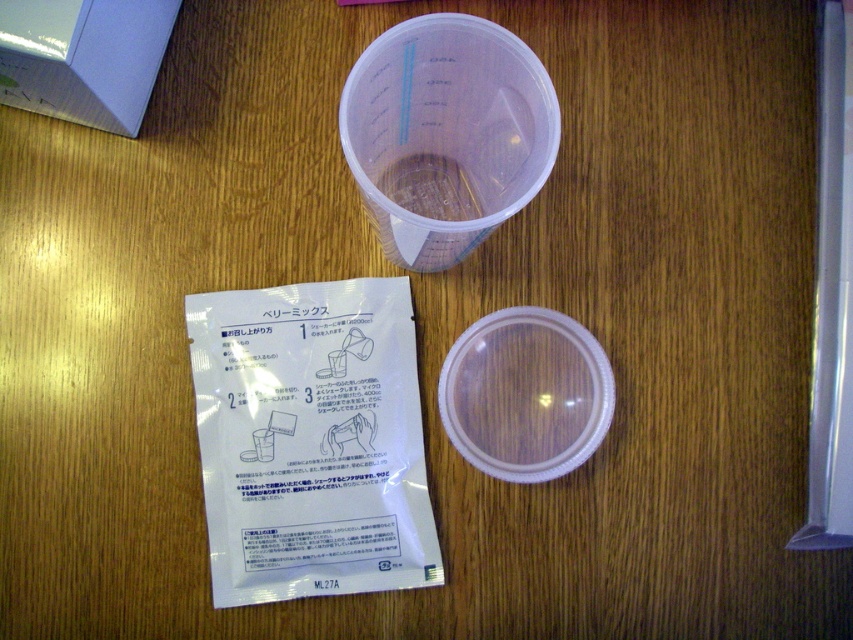
Which of these two, white matte packet at lower left or matte white box at upper left, stands shorter?

Standing shorter between the two is matte white box at upper left.

Can you confirm if white matte packet at lower left is bigger than matte white box at upper left?

Yes, white matte packet at lower left is bigger than matte white box at upper left.

The width and height of the screenshot is (853, 640). Identify the location of white matte packet at lower left. (311, 440).